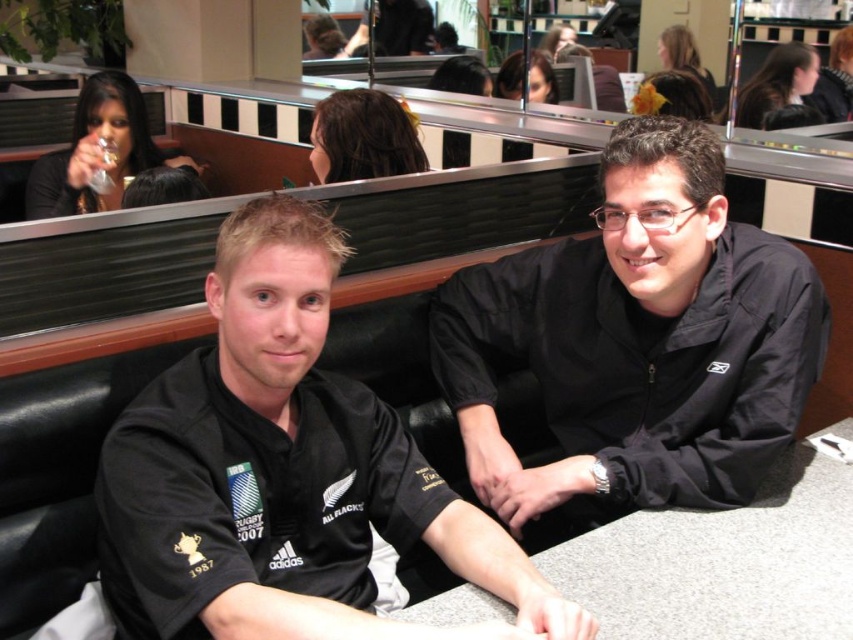
You are a photographer taking a picture of the two people sitting at the booth. You notice the black jersey at center and the black matte jacket at center. Which clothing item is closer to the camera?

The black matte jacket at center is closer to the camera because the black jersey at center is positioned under it.

You are a photographer positioned behind the two people at the booth. You want to take a photo where the black jersey at center is in focus while keeping the black matte jacket at center slightly blurred. Is this possible given their positions?

Yes, since the black jersey at center is closer to the viewer than the black matte jacket at center, adjusting the camera focus to the closer object will blur the background, making the black jersey at center sharp and the black matte jacket at center out of focus.